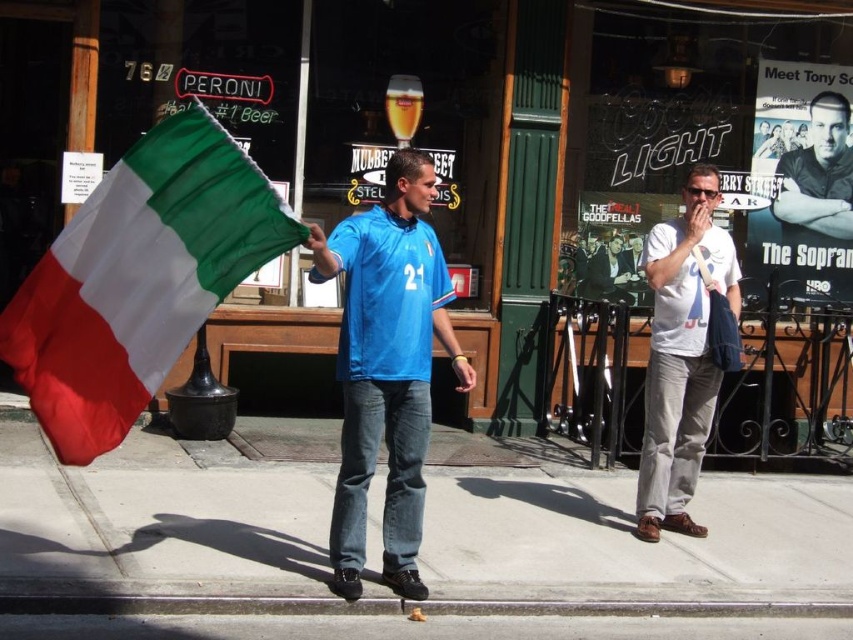
Between white cotton t-shirt at right and smooth black shirt at center, which one appears on the left side from the viewer's perspective?

white cotton t-shirt at right

Is white cotton t-shirt at right above smooth black shirt at center?

No, white cotton t-shirt at right is not above smooth black shirt at center.

Between point (672, 396) and point (813, 164), which one is positioned in front?

Point (672, 396)

In order to click on white cotton t-shirt at right in this screenshot , I will do `click(682, 355)`.

Between polyester fabric flag at left and blue jersey at center, which one has more height?

With more height is blue jersey at center.

Between point (84, 259) and point (349, 532), which one is positioned in front?

Point (84, 259) is in front.

Where is `polyester fabric flag at left`? Image resolution: width=853 pixels, height=640 pixels. polyester fabric flag at left is located at coordinates (138, 278).

Measure the distance between polyester fabric flag at left and camera.

polyester fabric flag at left and camera are 4.26 meters apart from each other.

Where is `polyester fabric flag at left`? polyester fabric flag at left is located at coordinates (138, 278).